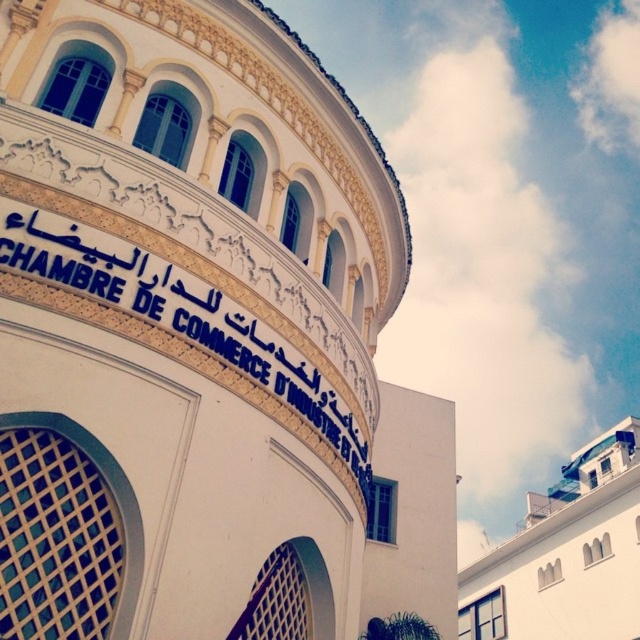
Question: Estimate the real-world distances between objects in this image. Which object is closer to the white stone building at center?

Choices:
 (A) white painted signboard at center
 (B) white matte building at upper right

Answer: (A)

Question: Based on their relative distances, which object is farther from the white painted signboard at center?

Choices:
 (A) white matte building at upper right
 (B) white stone building at center

Answer: (A)

Question: Which point is closer to the camera taking this photo?

Choices:
 (A) (12, 248)
 (B) (611, 534)

Answer: (A)

Question: Considering the relative positions of white stone building at center and white matte building at upper right in the image provided, where is white stone building at center located with respect to white matte building at upper right?

Choices:
 (A) above
 (B) below

Answer: (A)

Question: Is the position of white stone building at center less distant than that of white matte building at upper right?

Choices:
 (A) no
 (B) yes

Answer: (B)

Question: In this image, where is white stone building at center located relative to white matte building at upper right?

Choices:
 (A) left
 (B) right

Answer: (A)